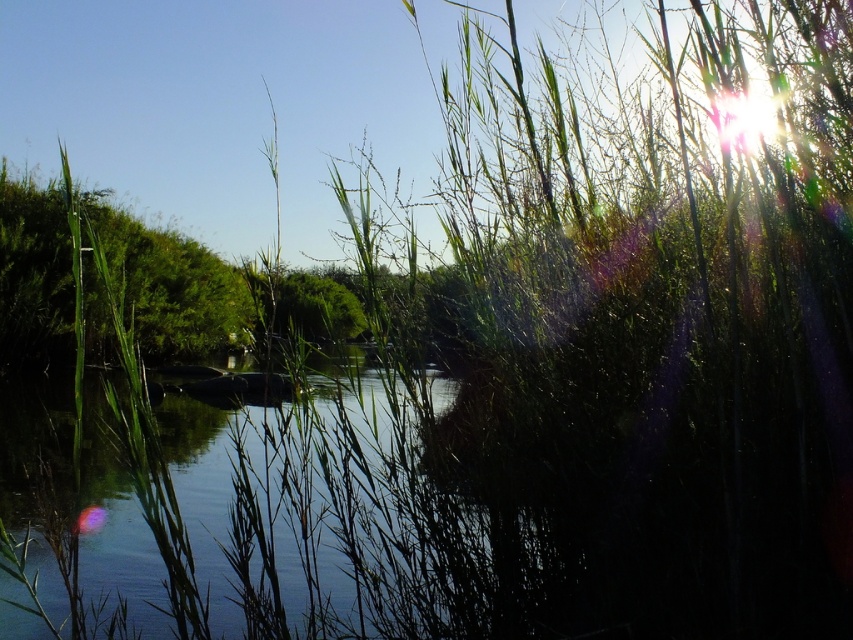
Question: Which point is closer to the camera?

Choices:
 (A) green leafy bush at left
 (B) clear water at center

Answer: (B)

Question: Does clear water at center have a lesser width compared to green leafy bush at left?

Choices:
 (A) yes
 (B) no

Answer: (B)

Question: Which of the following is the farthest from the observer?

Choices:
 (A) (241, 308)
 (B) (393, 612)

Answer: (A)

Question: Can you confirm if clear water at center is positioned above green leafy bush at left?

Choices:
 (A) no
 (B) yes

Answer: (A)

Question: Can you confirm if clear water at center is positioned to the right of green leafy bush at left?

Choices:
 (A) no
 (B) yes

Answer: (B)

Question: Among these objects, which one is farthest from the camera?

Choices:
 (A) clear water at center
 (B) green leafy bush at left

Answer: (B)